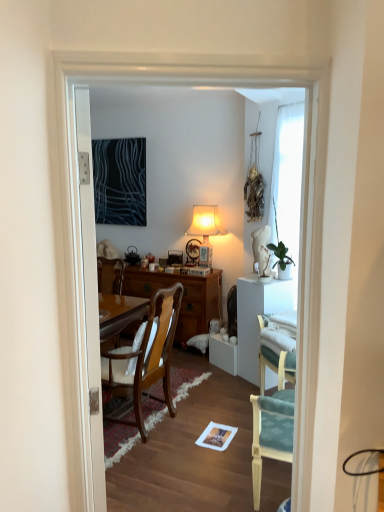
Question: From the image's perspective, is green glossy houseplant at upper right located above or below wooden chair with cushion at center, which is the 1th chair in left-to-right order?

Choices:
 (A) above
 (B) below

Answer: (A)

Question: Considering the relative positions of green glossy houseplant at upper right and wooden chair with cushion at center, which is the 1th chair in left-to-right order, in the image provided, is green glossy houseplant at upper right to the left or to the right of wooden chair with cushion at center, which is the 1th chair in left-to-right order,?

Choices:
 (A) left
 (B) right

Answer: (B)

Question: Which of these objects is positioned farthest from the green glossy houseplant at upper right?

Choices:
 (A) white glossy door at left
 (B) dark blue fabric at upper left
 (C) teal fabric chair at right, which is the first chair in right-to-left order
 (D) wooden chair with cushion at center, which is the 2th chair from front to back

Answer: (A)

Question: Considering the real-world distances, which object is closest to the dark blue fabric at upper left?

Choices:
 (A) green glossy houseplant at upper right
 (B) white glossy door at left
 (C) teal fabric chair at right, placed as the 2th chair when sorted from left to right
 (D) wooden chair with cushion at center, the first chair when ordered from back to front

Answer: (A)